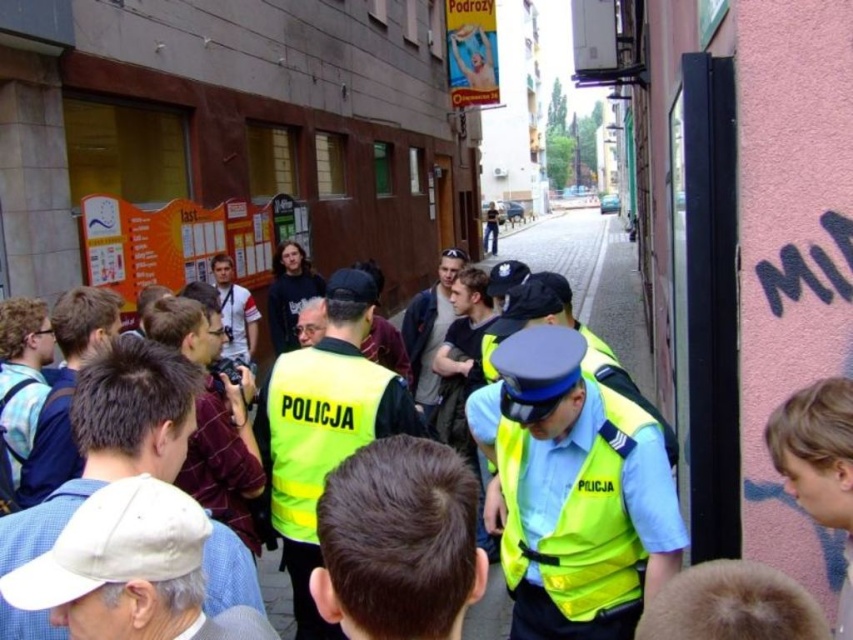
Is neon yellow reflective vest at center to the right of yellow reflective vests at center from the viewer's perspective?

Incorrect, neon yellow reflective vest at center is not on the right side of yellow reflective vests at center.

The image size is (853, 640). I want to click on neon yellow reflective vest at center, so click(573, 490).